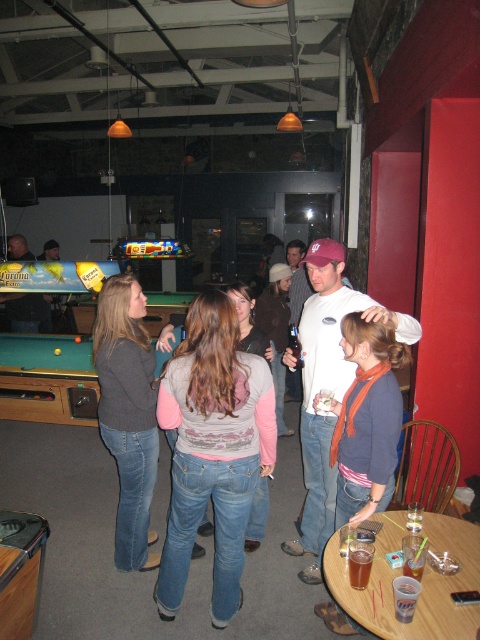
Does green felt pool table at lower left have a lesser width compared to translucent plastic cup at center?

Incorrect, green felt pool table at lower left's width is not less than translucent plastic cup at center's.

Does green felt pool table at lower left appear on the right side of translucent plastic cup at center?

Incorrect, green felt pool table at lower left is not on the right side of translucent plastic cup at center.

Who is more distant from viewer, (24, 380) or (408, 566)?

The point (24, 380) is more distant.

Where is `green felt pool table at lower left`? This screenshot has height=640, width=480. green felt pool table at lower left is located at coordinates click(48, 380).

Between point (159, 364) and point (180, 298), which one is positioned behind?

The point (180, 298) is more distant.

Consider the image. Does green felt pool table at lower left appear under green felt pool table at left?

Yes.

The image size is (480, 640). Identify the location of green felt pool table at lower left. (48, 380).

Based on the photo, can you confirm if white cotton t-shirt at center is smaller than green felt pool table at lower left?

Correct, white cotton t-shirt at center occupies less space than green felt pool table at lower left.

Between white cotton t-shirt at center and green felt pool table at lower left, which one is positioned higher?

green felt pool table at lower left

Is point (312, 550) positioned after point (48, 369)?

No, it is in front of (48, 369).

Identify the location of white cotton t-shirt at center. (327, 387).